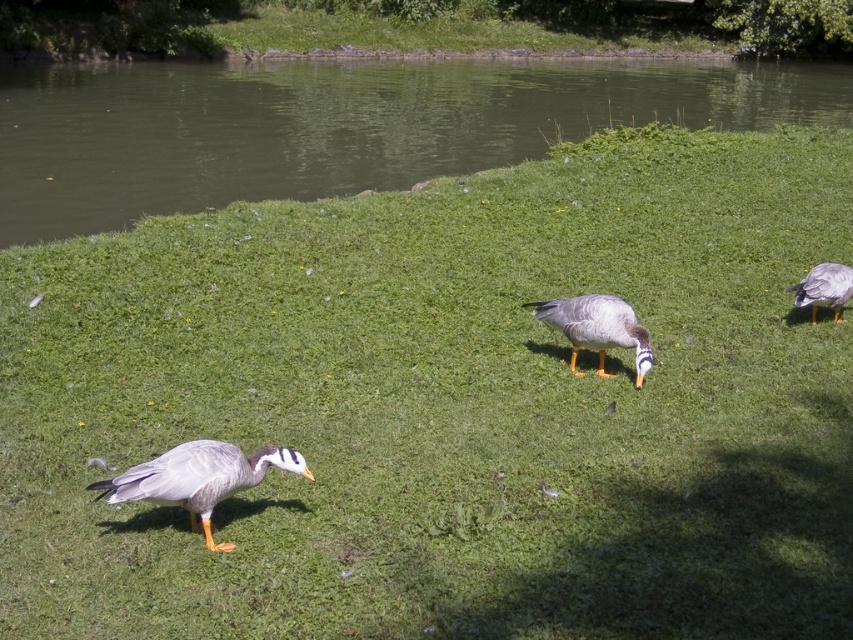
Question: Among these points, which one is nearest to the camera?

Choices:
 (A) (618, 321)
 (B) (375, 113)

Answer: (A)

Question: Can you confirm if gray matte goose at lower left is positioned to the right of gray matte duck at right?

Choices:
 (A) yes
 (B) no

Answer: (B)

Question: Considering the real-world distances, which object is closest to the green water at center?

Choices:
 (A) gray matte duck at right
 (B) gray matte duck at center
 (C) gray matte goose at lower left

Answer: (C)

Question: Is gray matte duck at center to the right of gray matte duck at right from the viewer's perspective?

Choices:
 (A) yes
 (B) no

Answer: (B)

Question: Can you confirm if green water at center is positioned below gray matte duck at center?

Choices:
 (A) no
 (B) yes

Answer: (A)

Question: Based on their relative distances, which object is nearer to the gray matte goose at lower left?

Choices:
 (A) green water at center
 (B) gray matte duck at right
 (C) gray matte duck at center

Answer: (C)